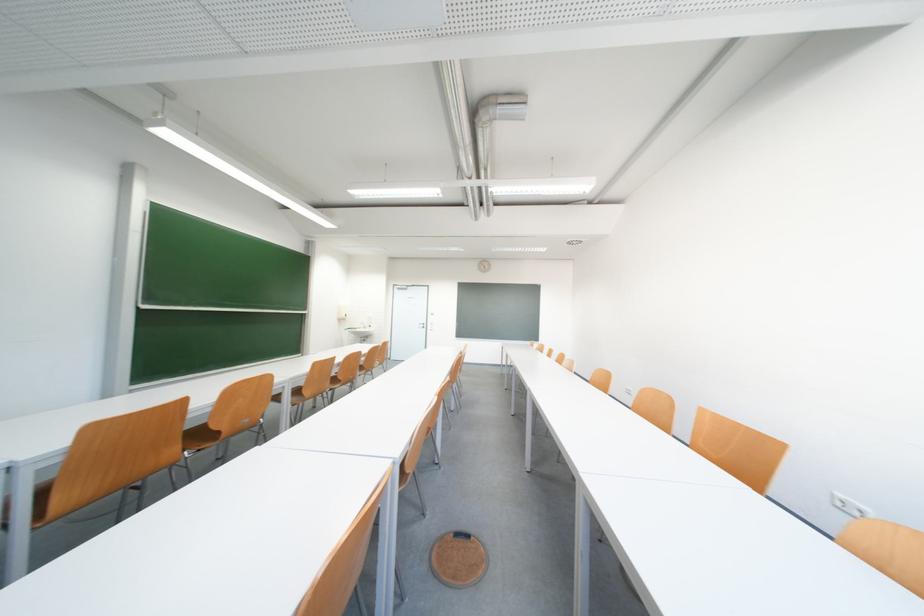
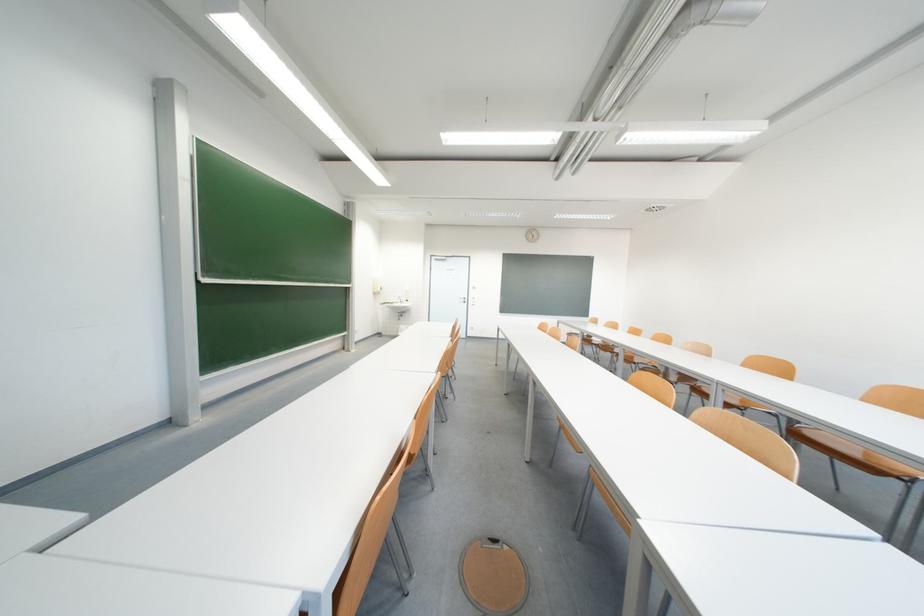
In a continuous first-person perspective shot, in which direction is the camera moving?

The movement direction of the cameraman is left, forward.